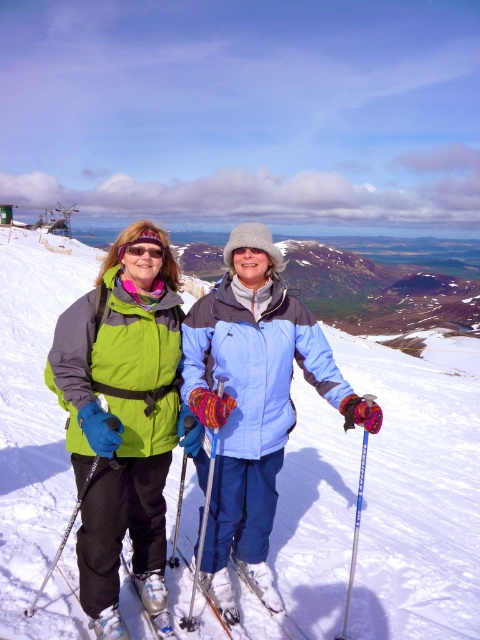
Question: Observing the image, what is the correct spatial positioning of matte green jacket at left in reference to white matte ski at lower center?

Choices:
 (A) above
 (B) below

Answer: (A)

Question: Does matte green jacket at center have a greater width compared to matte green jacket at left?

Choices:
 (A) yes
 (B) no

Answer: (A)

Question: Is matte green jacket at left wider than white matte ski at lower center?

Choices:
 (A) no
 (B) yes

Answer: (B)

Question: Which of these objects is positioned closest to the matte blue ski pole at center?

Choices:
 (A) white matte ski at lower center
 (B) blue plastic ski pole at center
 (C) matte green jacket at center
 (D) matte green jacket at left

Answer: (C)

Question: Among these objects, which one is nearest to the camera?

Choices:
 (A) blue plastic ski pole at center
 (B) matte green jacket at center
 (C) matte green jacket at left
 (D) white matte ski at lower center

Answer: (B)

Question: Among these points, which one is farthest from the camera?

Choices:
 (A) (75, 368)
 (B) (216, 380)

Answer: (B)